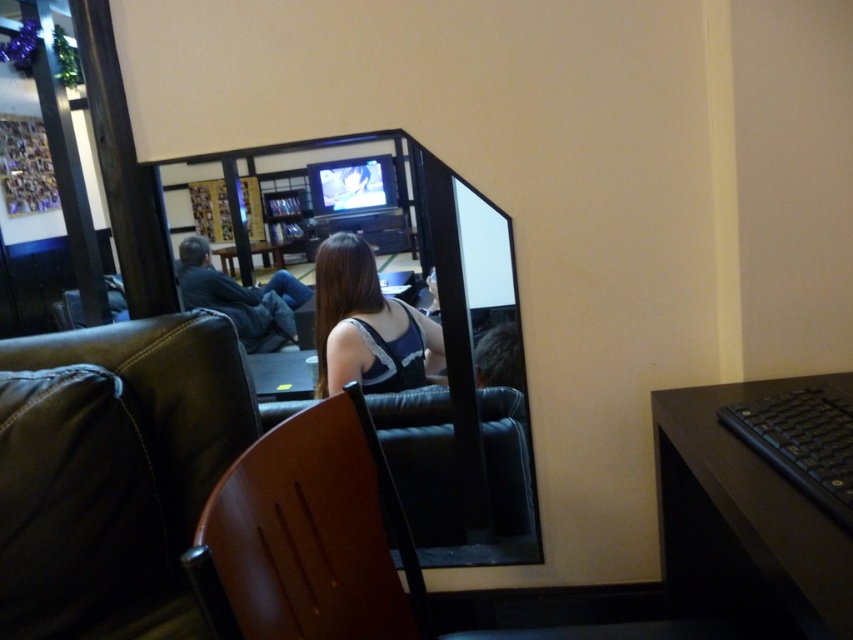
You are a delivery person who needs to place a tall package that is 2 meters in height. You see the dark blue jeans at left and the wooden table at center. Which object can the package be placed next to without hitting the ceiling?

The dark blue jeans at left is much taller than the wooden table at center, so the package should be placed next to the wooden table at center to avoid hitting the ceiling.